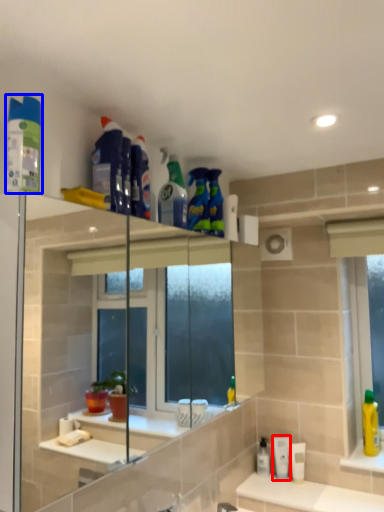
Question: Among these objects, which one is farthest to the camera, mouthwash (highlighted by a red box) or cleaning product (highlighted by a blue box)?

Choices:
 (A) mouthwash
 (B) cleaning product

Answer: (A)